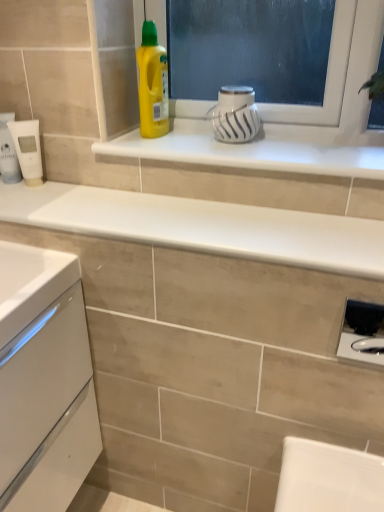
Question: Is white matte tube at left, acting as the second appliance starting from the bottom, oriented towards white matte tube at left?

Choices:
 (A) no
 (B) yes

Answer: (A)

Question: Is white matte tube at left, which is the 3th appliance from front to back, located outside white matte tube at left?

Choices:
 (A) no
 (B) yes

Answer: (B)

Question: Is white matte tube at left, which is the 3th appliance from front to back, taller than white matte tube at left?

Choices:
 (A) no
 (B) yes

Answer: (A)

Question: From the image's perspective, is white matte tube at left, which is the 3th appliance from front to back, on top of white matte tube at left?

Choices:
 (A) no
 (B) yes

Answer: (A)

Question: Does white matte tube at left, placed as the first appliance when sorted from left to right, have a larger size compared to white matte tube at left?

Choices:
 (A) no
 (B) yes

Answer: (A)

Question: Would you consider white matte tube at left, which is the 3th appliance from front to back, to be distant from white matte tube at left?

Choices:
 (A) no
 (B) yes

Answer: (A)

Question: From a real-world perspective, does white matte tube at left, the 2th appliance when ordered from top to bottom, stand above yellow plastic bottle at upper center?

Choices:
 (A) yes
 (B) no

Answer: (B)

Question: Does white matte tube at left, the 2th appliance when ordered from top to bottom, have a greater width compared to yellow plastic bottle at upper center?

Choices:
 (A) yes
 (B) no

Answer: (B)

Question: From a real-world perspective, is white matte tube at left, the first appliance in the back-to-front sequence, under yellow plastic bottle at upper center?

Choices:
 (A) yes
 (B) no

Answer: (A)

Question: Does white matte tube at left, the third appliance viewed from the right, contain yellow plastic bottle at upper center?

Choices:
 (A) no
 (B) yes

Answer: (A)

Question: Does white matte tube at left, which is the 3th appliance from front to back, have a greater height compared to yellow plastic bottle at upper center?

Choices:
 (A) yes
 (B) no

Answer: (B)

Question: Is white matte tube at left, the third appliance viewed from the right, in front of yellow plastic bottle at upper center?

Choices:
 (A) yes
 (B) no

Answer: (B)

Question: From the image's perspective, would you say yellow plastic bottle at upper center is positioned over white glossy mug at upper center, the 1th appliance from the top?

Choices:
 (A) yes
 (B) no

Answer: (A)